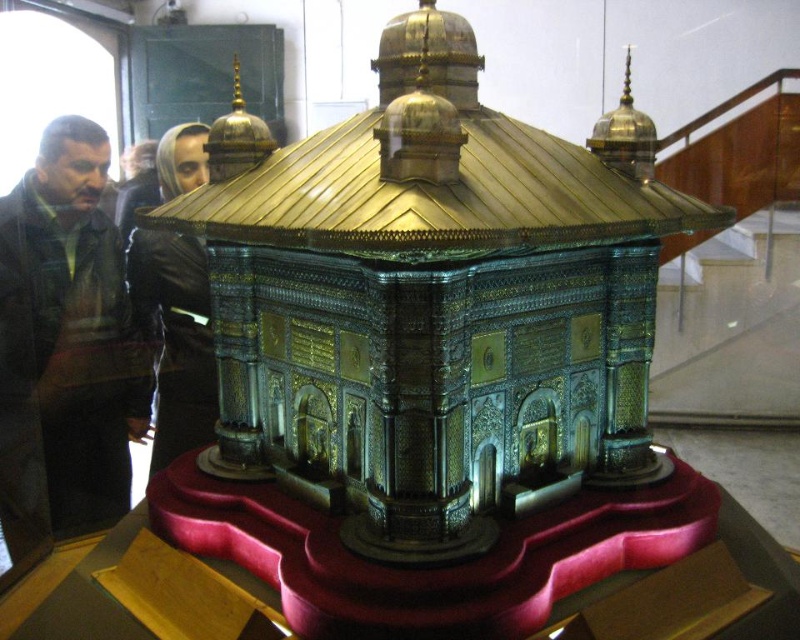
Question: Observing the image, what is the correct spatial positioning of brushed metal jacket at left in reference to black leather jacket at center?

Choices:
 (A) right
 (B) left

Answer: (B)

Question: Can you confirm if brushed metal jacket at left is positioned to the right of black leather jacket at center?

Choices:
 (A) no
 (B) yes

Answer: (A)

Question: Does brushed metal jacket at left appear on the left side of black leather jacket at center?

Choices:
 (A) yes
 (B) no

Answer: (A)